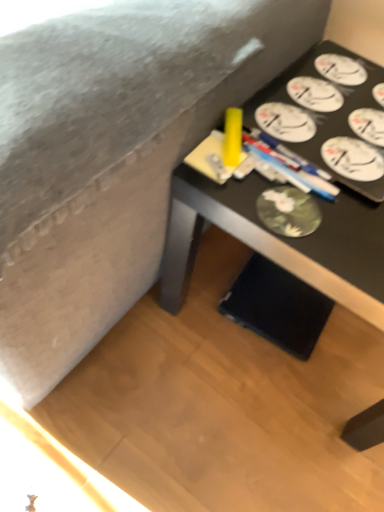
You are a GUI agent. You are given a task and a screenshot of the screen. Output one action in this format:
    pyautogui.click(x=<x>, y=<y>)
    Task: Click on the vacant space situated above black matte desk at lower right (from a real-world perspective)
    This screenshot has height=512, width=384.
    Given the screenshot: What is the action you would take?
    pyautogui.click(x=328, y=152)